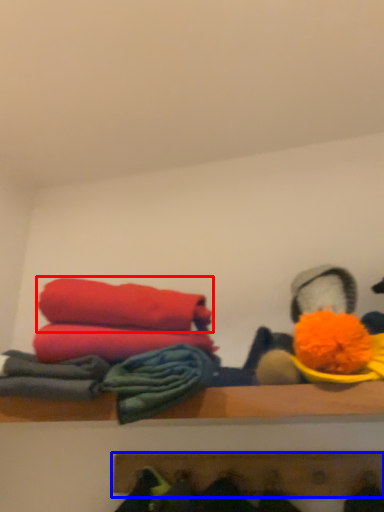
Question: Which point is closer to the camera, towel (highlighted by a red box) or shelf (highlighted by a blue box)?

Choices:
 (A) towel
 (B) shelf

Answer: (A)